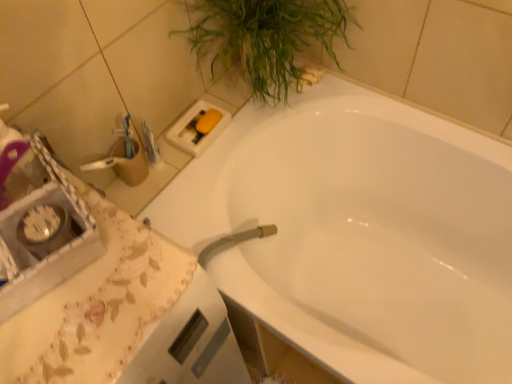
Question: From a real-world perspective, is white glossy bathtub at upper center positioned under white fabric at lower left based on gravity?

Choices:
 (A) yes
 (B) no

Answer: (A)

Question: From a real-world perspective, is white glossy bathtub at upper center located higher than white fabric at lower left?

Choices:
 (A) yes
 (B) no

Answer: (B)

Question: Is white glossy bathtub at upper center shorter than white fabric at lower left?

Choices:
 (A) no
 (B) yes

Answer: (B)

Question: Considering the relative sizes of white glossy bathtub at upper center and white fabric at lower left in the image provided, is white glossy bathtub at upper center smaller than white fabric at lower left?

Choices:
 (A) yes
 (B) no

Answer: (B)

Question: Does white glossy bathtub at upper center appear on the left side of white fabric at lower left?

Choices:
 (A) yes
 (B) no

Answer: (B)

Question: Does white glossy bathtub at upper center have a greater height compared to white fabric at lower left?

Choices:
 (A) no
 (B) yes

Answer: (A)

Question: Can you confirm if white fabric at lower left is wider than white glossy bathtub at upper center?

Choices:
 (A) no
 (B) yes

Answer: (A)

Question: Is white fabric at lower left positioned far away from white glossy bathtub at upper center?

Choices:
 (A) no
 (B) yes

Answer: (A)

Question: Is white fabric at lower left smaller than white glossy bathtub at upper center?

Choices:
 (A) no
 (B) yes

Answer: (B)

Question: Would you say white glossy bathtub at upper center is part of white fabric at lower left's contents?

Choices:
 (A) no
 (B) yes

Answer: (A)

Question: Is white fabric at lower left turned away from white glossy bathtub at upper center?

Choices:
 (A) no
 (B) yes

Answer: (A)

Question: From a real-world perspective, is white fabric at lower left located beneath white glossy bathtub at upper center?

Choices:
 (A) yes
 (B) no

Answer: (B)

Question: Is green leafy plant at upper right at the back of white fabric at lower left?

Choices:
 (A) no
 (B) yes

Answer: (A)